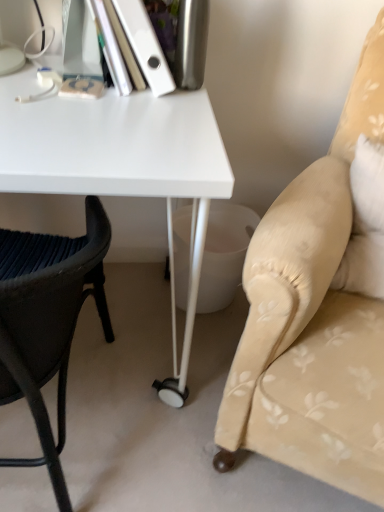
Image resolution: width=384 pixels, height=512 pixels. In order to click on white matte book at upper left in this screenshot , I will do `click(133, 45)`.

What do you see at coordinates (116, 154) in the screenshot?
I see `white glossy desk at center` at bounding box center [116, 154].

Measure the distance between point (131,132) and camera.

The distance of point (131,132) from camera is 30.59 inches.

The height and width of the screenshot is (512, 384). Describe the element at coordinates (313, 321) in the screenshot. I see `beige fabric cushion at right, acting as the first chair starting from the right` at that location.

Find the location of a particular element. black woven chair at left, which ranks as the first chair in left-to-right order is located at coordinates (47, 322).

What do you see at coordinates (47, 322) in the screenshot?
I see `black woven chair at left, marked as the second chair in a right-to-left arrangement` at bounding box center [47, 322].

The height and width of the screenshot is (512, 384). In order to click on white matte book at upper left in this screenshot , I will do `click(133, 45)`.

Is white glossy desk at center with beige fabric cushion at right, which ranks as the second chair in left-to-right order?

No.

From a real-world perspective, is white glossy desk at center below beige fabric cushion at right, acting as the first chair starting from the right?

Yes, from a real-world perspective, white glossy desk at center is beneath beige fabric cushion at right, acting as the first chair starting from the right.

Which object is closer to the camera taking this photo, white glossy desk at center or beige fabric cushion at right, which ranks as the second chair in left-to-right order?

beige fabric cushion at right, which ranks as the second chair in left-to-right order, is in front.

How much distance is there between white glossy desk at center and beige fabric cushion at right, acting as the first chair starting from the right?

white glossy desk at center is 12.19 inches from beige fabric cushion at right, acting as the first chair starting from the right.

From a real-world perspective, is beige fabric cushion at right, which ranks as the second chair in left-to-right order, beneath white glossy desk at center?

Incorrect, from a real-world perspective, beige fabric cushion at right, which ranks as the second chair in left-to-right order, is higher than white glossy desk at center.

Which object is closer to the camera, beige fabric cushion at right, which ranks as the second chair in left-to-right order, or white glossy desk at center?

beige fabric cushion at right, which ranks as the second chair in left-to-right order, is in front.

Would you consider beige fabric cushion at right, acting as the first chair starting from the right, to be distant from white glossy desk at center?

No, beige fabric cushion at right, acting as the first chair starting from the right, is not far away from white glossy desk at center.

Could you tell me if beige fabric cushion at right, acting as the first chair starting from the right, is facing white glossy desk at center?

No.

Considering the sizes of objects white matte book at upper left and white glossy desk at center in the image provided, who is shorter, white matte book at upper left or white glossy desk at center?

With less height is white matte book at upper left.

Is white matte book at upper left beside white glossy desk at center?

white matte book at upper left is not next to white glossy desk at center, and they're not touching.

Which is more to the left, white matte book at upper left or white glossy desk at center?

white glossy desk at center is more to the left.

Where is `paperback book on the right of the white glossy desk at center`? The width and height of the screenshot is (384, 512). paperback book on the right of the white glossy desk at center is located at coordinates 133,45.

Does beige fabric cushion at right, acting as the first chair starting from the right, appear on the left side of white matte book at upper left?

No, beige fabric cushion at right, acting as the first chair starting from the right, is not to the left of white matte book at upper left.

Consider the image. Can you tell me how much beige fabric cushion at right, acting as the first chair starting from the right, and white matte book at upper left differ in facing direction?

The facing directions of beige fabric cushion at right, acting as the first chair starting from the right, and white matte book at upper left are 37.6 degrees apart.

From a real-world perspective, is beige fabric cushion at right, which ranks as the second chair in left-to-right order, physically located above or below white matte book at upper left?

From a real-world perspective, beige fabric cushion at right, which ranks as the second chair in left-to-right order, is physically below white matte book at upper left.

Considering the sizes of beige fabric cushion at right, which ranks as the second chair in left-to-right order, and white matte book at upper left in the image, is beige fabric cushion at right, which ranks as the second chair in left-to-right order, bigger or smaller than white matte book at upper left?

beige fabric cushion at right, which ranks as the second chair in left-to-right order, is bigger than white matte book at upper left.

Would you consider white glossy desk at center to be distant from white matte book at upper left?

white glossy desk at center is near white matte book at upper left, not far away.

From a real-world perspective, is white glossy desk at center under white matte book at upper left?

Yes, from a real-world perspective, white glossy desk at center is under white matte book at upper left.

Is white glossy desk at center positioned with its back to white matte book at upper left?

No, white glossy desk at center is not facing away from white matte book at upper left.

Is white glossy desk at center wider than white matte book at upper left?

Yes.

Is white matte book at upper left oriented towards black woven chair at left, marked as the second chair in a right-to-left arrangement?

No.

Can you confirm if white matte book at upper left is taller than black woven chair at left, which ranks as the first chair in left-to-right order?

No.

Are white matte book at upper left and black woven chair at left, which ranks as the first chair in left-to-right order, beside each other?

No, white matte book at upper left is not touching black woven chair at left, which ranks as the first chair in left-to-right order.

Is black woven chair at left, which ranks as the first chair in left-to-right order, bigger than white matte book at upper left?

Yes, black woven chair at left, which ranks as the first chair in left-to-right order, is bigger than white matte book at upper left.

Is black woven chair at left, which ranks as the first chair in left-to-right order, far from white matte book at upper left?

No, black woven chair at left, which ranks as the first chair in left-to-right order, is in close proximity to white matte book at upper left.

Between black woven chair at left, which ranks as the first chair in left-to-right order, and white matte book at upper left, which one has less height?

Standing shorter between the two is white matte book at upper left.

Is black woven chair at left, marked as the second chair in a right-to-left arrangement, inside the boundaries of white matte book at upper left, or outside?

black woven chair at left, marked as the second chair in a right-to-left arrangement, is not inside white matte book at upper left, it's outside.

Identify the location of chair above the white glossy desk at center (from a real-world perspective). tap(313, 321).

You are a GUI agent. You are given a task and a screenshot of the screen. Output one action in this format:
    pyautogui.click(x=<x>, y=<y>)
    Task: Click on the desk above the beige fabric cushion at right, acting as the first chair starting from the right (from the image's perspective)
    Image resolution: width=384 pixels, height=512 pixels.
    Given the screenshot: What is the action you would take?
    pyautogui.click(x=116, y=154)

Which object lies nearer to the anchor point white glossy desk at center, beige fabric cushion at right, which ranks as the second chair in left-to-right order, or white matte book at upper left?

white matte book at upper left is closer to white glossy desk at center.

Which object lies further to the anchor point beige fabric cushion at right, acting as the first chair starting from the right, white glossy desk at center or black woven chair at left, which ranks as the first chair in left-to-right order?

Among the two, black woven chair at left, which ranks as the first chair in left-to-right order, is located further to beige fabric cushion at right, acting as the first chair starting from the right.

Estimate the real-world distances between objects in this image. Which object is further from black woven chair at left, which ranks as the first chair in left-to-right order, white glossy desk at center or white matte book at upper left?

Based on the image, white matte book at upper left appears to be further to black woven chair at left, which ranks as the first chair in left-to-right order.

From the image, which object appears to be farther from white matte book at upper left, beige fabric cushion at right, which ranks as the second chair in left-to-right order, or black woven chair at left, which ranks as the first chair in left-to-right order?

beige fabric cushion at right, which ranks as the second chair in left-to-right order, lies further to white matte book at upper left than the other object.

Considering their positions, is black woven chair at left, marked as the second chair in a right-to-left arrangement, positioned closer to white matte book at upper left than beige fabric cushion at right, acting as the first chair starting from the right?

black woven chair at left, marked as the second chair in a right-to-left arrangement, lies closer to white matte book at upper left than the other object.

Based on their spatial positions, is white matte book at upper left or beige fabric cushion at right, which ranks as the second chair in left-to-right order, closer to white glossy desk at center?

white matte book at upper left lies closer to white glossy desk at center than the other object.

Based on their spatial positions, is white matte book at upper left or black woven chair at left, marked as the second chair in a right-to-left arrangement, further from white glossy desk at center?

black woven chair at left, marked as the second chair in a right-to-left arrangement, is positioned further to the anchor white glossy desk at center.

Which object lies nearer to the anchor point white matte book at upper left, black woven chair at left, marked as the second chair in a right-to-left arrangement, or white glossy desk at center?

Result: white glossy desk at center.

Where is `desk between white matte book at upper left and black woven chair at left, marked as the second chair in a right-to-left arrangement, vertically`? Image resolution: width=384 pixels, height=512 pixels. desk between white matte book at upper left and black woven chair at left, marked as the second chair in a right-to-left arrangement, vertically is located at coordinates (116, 154).

You are a GUI agent. You are given a task and a screenshot of the screen. Output one action in this format:
    pyautogui.click(x=<x>, y=<y>)
    Task: Click on the paperback book situated between white glossy desk at center and beige fabric cushion at right, acting as the first chair starting from the right, from left to right
    
    Given the screenshot: What is the action you would take?
    click(133, 45)

Where is `paperback book between black woven chair at left, marked as the second chair in a right-to-left arrangement, and beige fabric cushion at right, acting as the first chair starting from the right`? paperback book between black woven chair at left, marked as the second chair in a right-to-left arrangement, and beige fabric cushion at right, acting as the first chair starting from the right is located at coordinates (133, 45).

I want to click on desk located between black woven chair at left, marked as the second chair in a right-to-left arrangement, and beige fabric cushion at right, acting as the first chair starting from the right, in the left-right direction, so click(x=116, y=154).